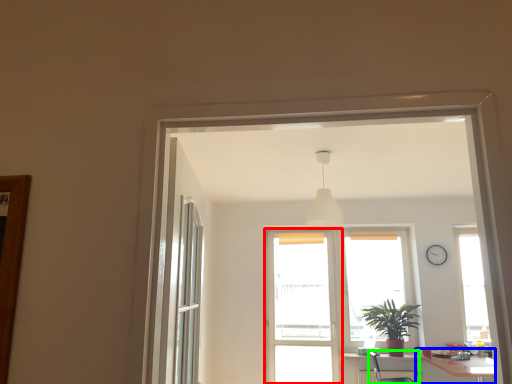
Question: Considering the real-world distances, which object is closest to screen door (highlighted by a red box)? table (highlighted by a blue box) or armchair (highlighted by a green box).

Choices:
 (A) table
 (B) armchair

Answer: (B)